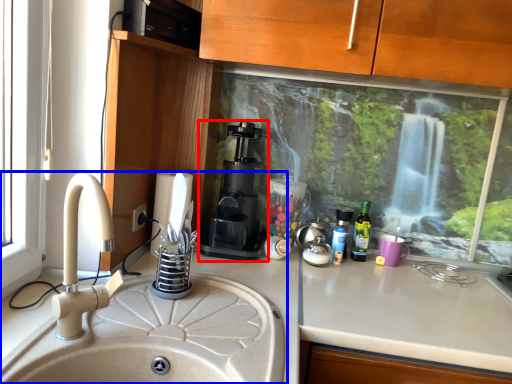
Question: Which object appears farthest to the camera in this image, coffee machine (highlighted by a red box) or sink (highlighted by a blue box)?

Choices:
 (A) coffee machine
 (B) sink

Answer: (A)